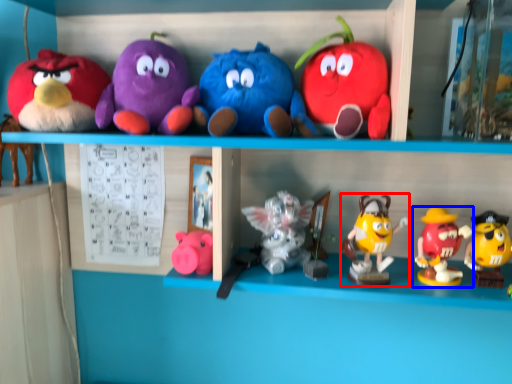
Question: Which object appears closest to the camera in this image, toy (highlighted by a red box) or toy (highlighted by a blue box)?

Choices:
 (A) toy
 (B) toy

Answer: (B)